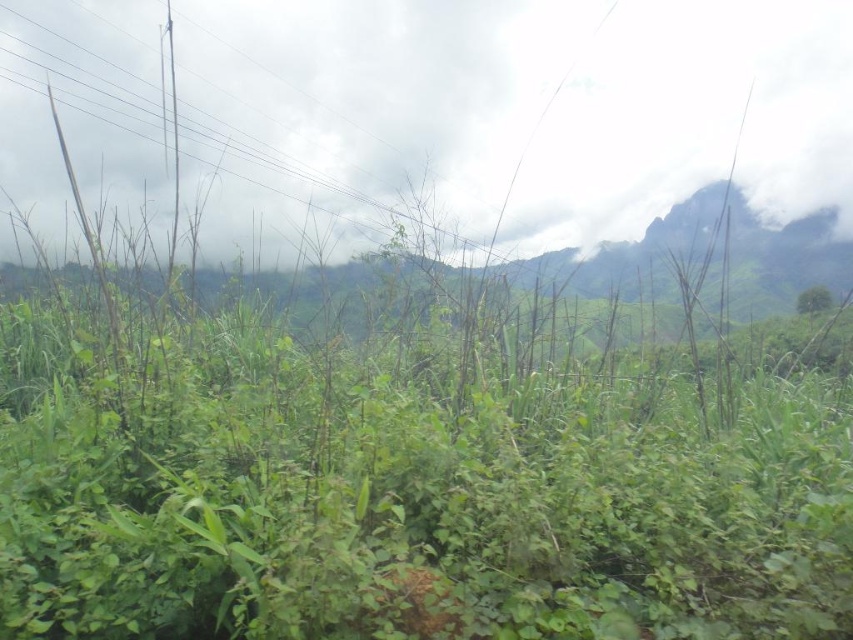
You are planning to take a photo of the green leafy tree at center and the white fluffy cloud at upper center. Which object will appear larger in the photo?

The white fluffy cloud at upper center will appear larger in the photo because it is bigger than the green leafy tree at center.

You are an observer looking at the landscape. You notice the white fluffy cloud at upper center and the green leafy tree at center. Which one appears taller in the scene?

The white fluffy cloud at upper center is taller than the green leafy tree at center according to the description.

You are standing in the lush green landscape described. You notice a point marked at coordinates [502,116]. What object is located at this point?

The point at coordinates [502,116] corresponds to a white fluffy cloud at upper center.